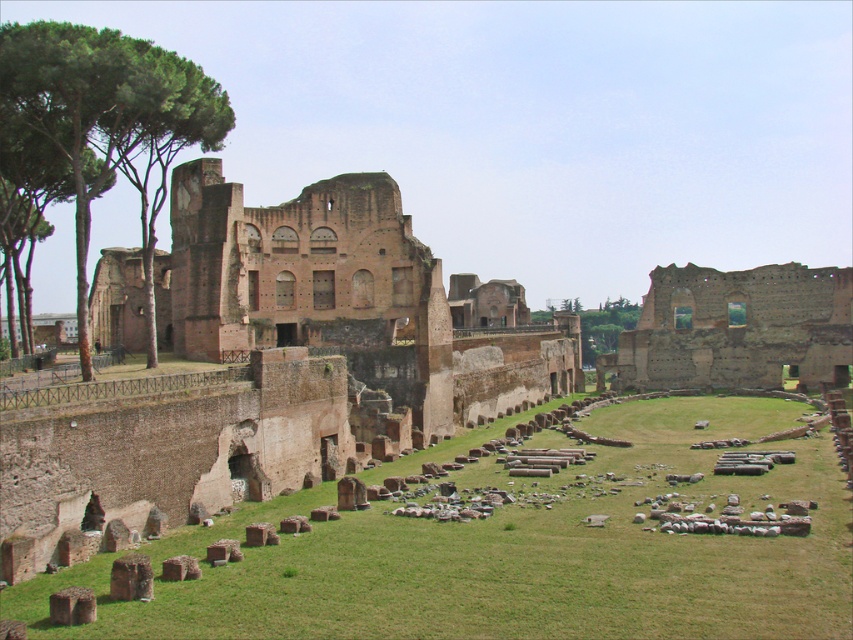
You are standing at the entrance of the ancient Roman structure and want to find a spot to rest. You see the green grass at center and the green leafy tree at upper left. Which location is closer to the ground?

Result: The green grass at center is closer to the ground because it is located below the green leafy tree at upper left.

You are standing at the ruins of an ancient Roman structure. You see a point marked at coordinates (515, 554). Based on the scene description, what surface is this point located on?

The point is located on the green grass at center.

You are an archaeologist examining the ancient Roman structure. You notice the green grass at center and the brown stone ruins at center right. Which object is located above the other?

The brown stone ruins at center right are above the green grass at center because the green grass at center is positioned under the brown stone ruins at center right.